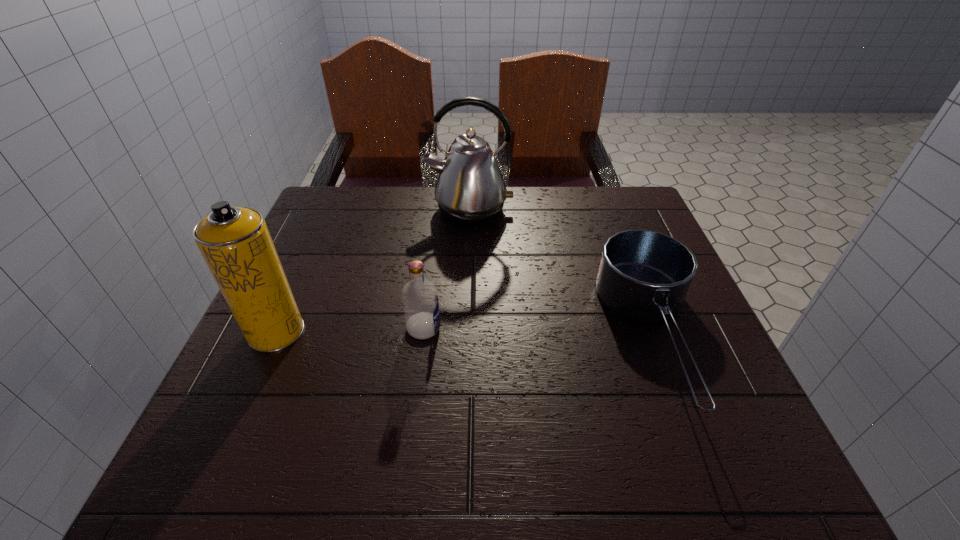
This screenshot has width=960, height=540. In order to click on object that is at the left edge in this screenshot , I will do `click(235, 242)`.

At what (x,y) coordinates should I click in order to perform the action: click on object located in the right edge section of the desktop. Please return your answer as a coordinate pair (x, y). The image size is (960, 540). Looking at the image, I should click on (644, 275).

At what (x,y) coordinates should I click in order to perform the action: click on object positioned at the near right corner. Please return your answer as a coordinate pair (x, y). Image resolution: width=960 pixels, height=540 pixels. Looking at the image, I should click on (644, 275).

This screenshot has height=540, width=960. Find the location of `blank space at the far edge`. blank space at the far edge is located at coordinates [x=522, y=201].

This screenshot has width=960, height=540. What are the coordinates of `vacant area at the near edge of the desktop` in the screenshot? It's located at (528, 441).

This screenshot has height=540, width=960. Identify the location of vacant space at the left edge. (316, 384).

At what (x,y) coordinates should I click in order to perform the action: click on vacant position at the far left corner of the desktop. Please return your answer as a coordinate pair (x, y). Looking at the image, I should click on (318, 216).

Find the location of a particular element. This screenshot has width=960, height=540. free space at the near right corner is located at coordinates (754, 467).

Identify the location of free space between the farthest object and the rightmost object. (562, 273).

Locate an element on the screen. Image resolution: width=960 pixels, height=540 pixels. vacant space that's between the aerosol can and the second shortest object is located at coordinates (350, 330).